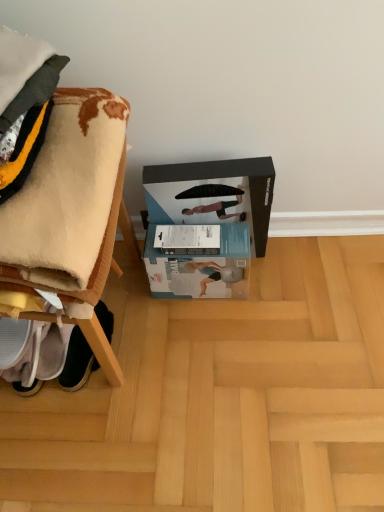
Where is `vacant space to the right of black matte cardboard box at center`? vacant space to the right of black matte cardboard box at center is located at coordinates pyautogui.click(x=292, y=264).